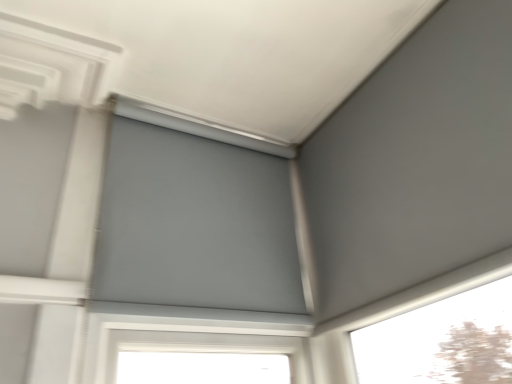
The image size is (512, 384). What do you see at coordinates (195, 224) in the screenshot?
I see `matte gray screen door at upper center` at bounding box center [195, 224].

At what (x,y) coordinates should I click in order to perform the action: click on matte gray screen door at upper center. Please return your answer as a coordinate pair (x, y). The image size is (512, 384). Looking at the image, I should click on (195, 224).

You are a GUI agent. You are given a task and a screenshot of the screen. Output one action in this format:
    pyautogui.click(x=<x>, y=<y>)
    Task: Click on the matte gray screen door at upper center
    The width and height of the screenshot is (512, 384).
    Given the screenshot: What is the action you would take?
    pyautogui.click(x=195, y=224)